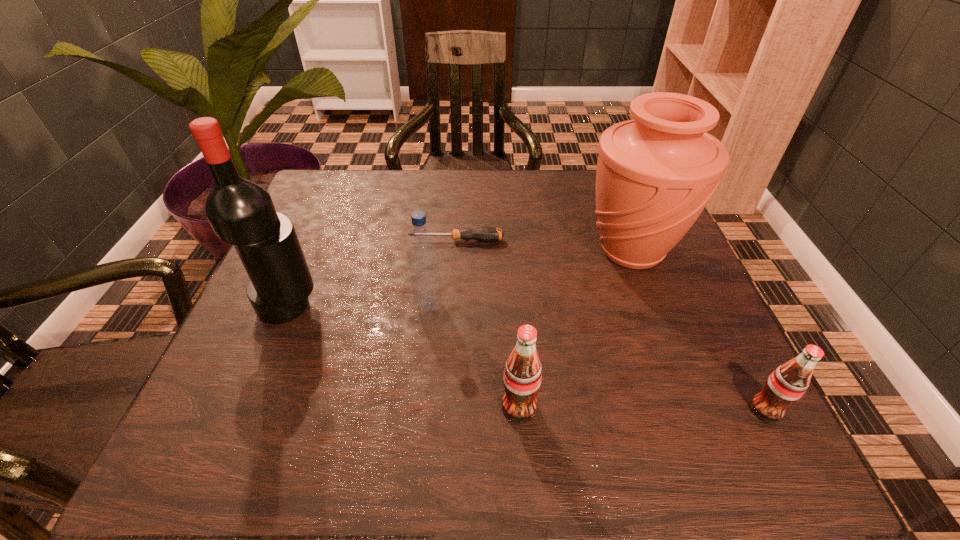
You are a GUI agent. You are given a task and a screenshot of the screen. Output one action in this format:
    pyautogui.click(x=<x>, y=<y>)
    Task: Click on the empty space between the second shortest object and the shortest object
    
    Given the screenshot: What is the action you would take?
    pyautogui.click(x=611, y=325)

Where is `vacant region between the wine bottle and the water bottle`? The height and width of the screenshot is (540, 960). vacant region between the wine bottle and the water bottle is located at coordinates (359, 306).

The width and height of the screenshot is (960, 540). Identify the location of free area in between the shorter soda and the vase. (698, 330).

The height and width of the screenshot is (540, 960). I want to click on vacant space that's between the fifth shortest object and the water bottle, so [530, 278].

I want to click on blank region between the vase and the leftmost object, so click(x=460, y=279).

The height and width of the screenshot is (540, 960). Find the location of `object that can be found as the third closest to the shortest object`. object that can be found as the third closest to the shortest object is located at coordinates (241, 212).

Where is `the fourth closest object relative to the water bottle`? The width and height of the screenshot is (960, 540). the fourth closest object relative to the water bottle is located at coordinates tap(655, 174).

The height and width of the screenshot is (540, 960). What are the coordinates of `vacant point that satisfies the following two spatial constraints: 1. on the front side of the water bottle; 2. on the left side of the taller soda` in the screenshot? It's located at coord(417,407).